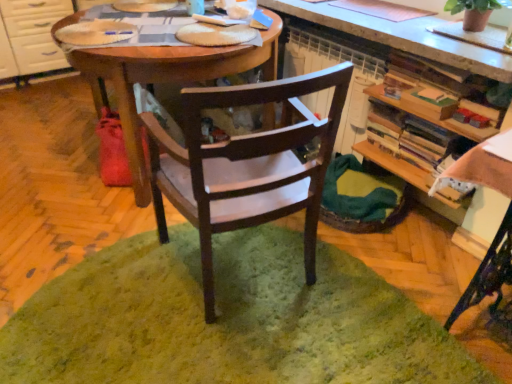
Identify the location of free location to the right of mahogany wood chair at center. (356, 297).